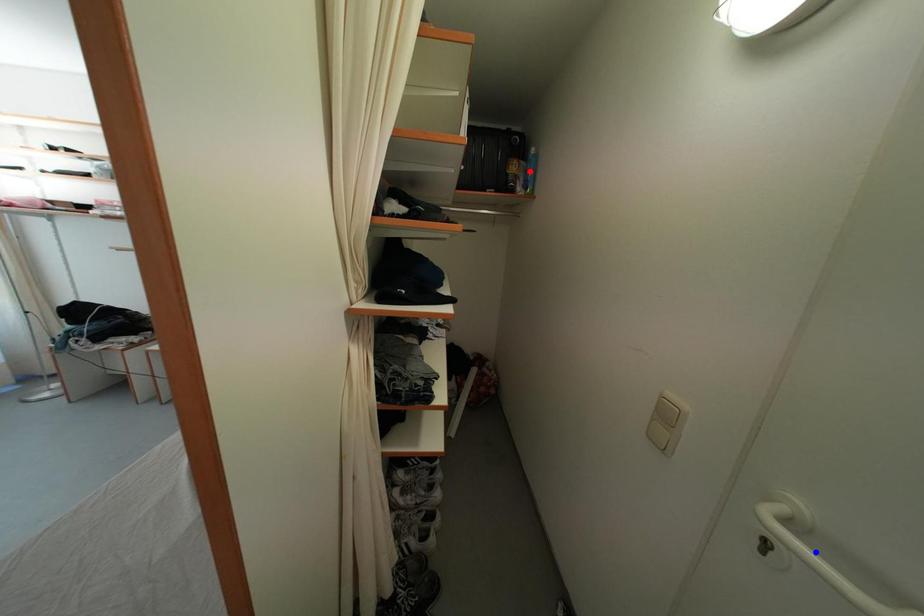
Question: Which of the two points in the image is closer to the camera?

Choices:
 (A) Blue point is closer.
 (B) Red point is closer.

Answer: (A)